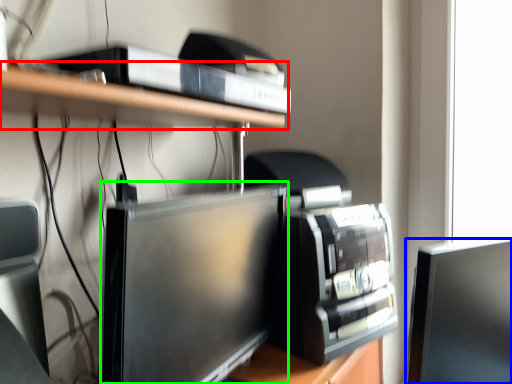
Question: Based on their relative distances, which object is nearer to shelf (highlighted by a red box)? Choose from computer monitor (highlighted by a blue box) and computer monitor (highlighted by a green box).

Choices:
 (A) computer monitor
 (B) computer monitor

Answer: (B)